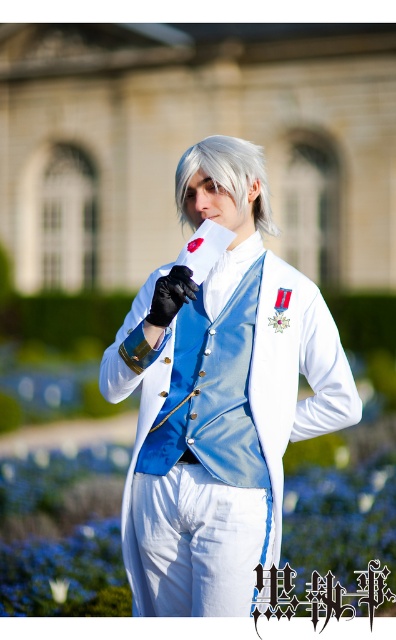
Question: Does white glossy vest at center appear on the right side of slick silver hair at center?

Choices:
 (A) yes
 (B) no

Answer: (A)

Question: Which point appears farthest from the camera in this image?

Choices:
 (A) (251, 176)
 (B) (291, 387)

Answer: (A)

Question: Does white glossy vest at center appear under slick silver hair at center?

Choices:
 (A) yes
 (B) no

Answer: (A)

Question: Which point is farther from the camera taking this photo?

Choices:
 (A) click(177, 177)
 (B) click(350, 369)

Answer: (A)

Question: Among these objects, which one is farthest from the camera?

Choices:
 (A) white glossy vest at center
 (B) slick silver hair at center

Answer: (B)

Question: Can you confirm if white glossy vest at center is smaller than slick silver hair at center?

Choices:
 (A) yes
 (B) no

Answer: (A)